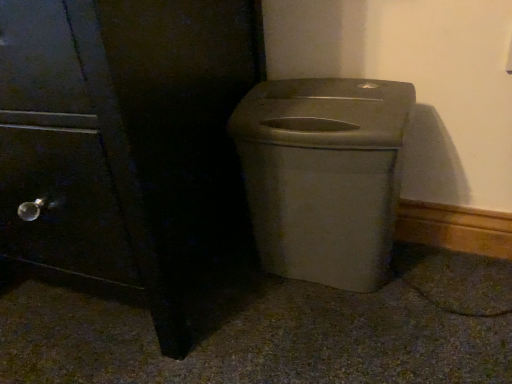
Question: From the image's perspective, relative to matte plastic trash can at center, is matte black side cabinet at left above or below?

Choices:
 (A) above
 (B) below

Answer: (A)

Question: Is matte black side cabinet at left spatially inside matte plastic trash can at center, or outside of it?

Choices:
 (A) inside
 (B) outside

Answer: (B)

Question: Based on their sizes in the image, would you say matte black side cabinet at left is bigger or smaller than matte plastic trash can at center?

Choices:
 (A) big
 (B) small

Answer: (A)

Question: Looking at the image, does matte plastic trash can at center seem bigger or smaller compared to matte black side cabinet at left?

Choices:
 (A) big
 (B) small

Answer: (B)

Question: Relative to matte black side cabinet at left, is matte plastic trash can at center in front or behind?

Choices:
 (A) behind
 (B) front

Answer: (A)

Question: From the image's perspective, is matte plastic trash can at center positioned above or below matte black side cabinet at left?

Choices:
 (A) above
 (B) below

Answer: (B)

Question: From a real-world perspective, is matte plastic trash can at center physically located above or below matte black side cabinet at left?

Choices:
 (A) above
 (B) below

Answer: (B)